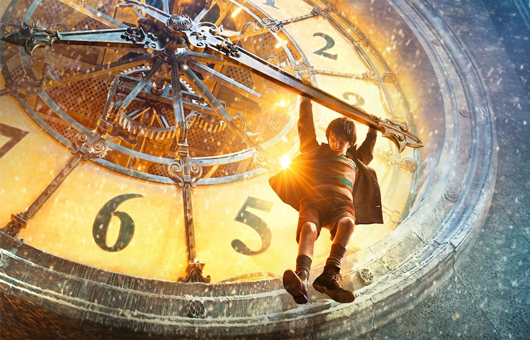
Locate an element on the screen. clock is located at coordinates (245, 109).